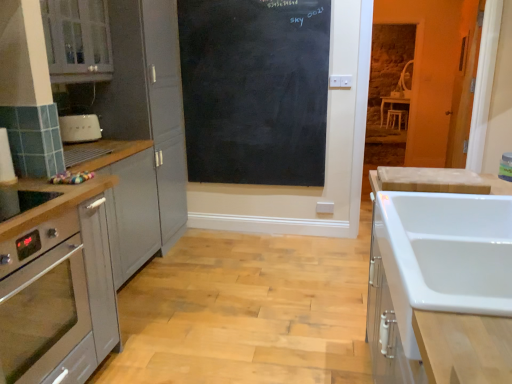
Question: From the image's perspective, is matte gray cabinet at upper left, which is the 1th cabinetry in left-to-right order, under white glossy sink at right, which appears as the first cabinetry when viewed from the right?

Choices:
 (A) no
 (B) yes

Answer: (A)

Question: Is matte gray cabinet at upper left, the third cabinetry when ordered from right to left, in contact with white glossy sink at right, arranged as the 3th cabinetry when viewed from the left?

Choices:
 (A) yes
 (B) no

Answer: (B)

Question: Is matte gray cabinet at upper left, the third cabinetry when ordered from right to left, far away from white glossy sink at right, which appears as the first cabinetry when viewed from the right?

Choices:
 (A) yes
 (B) no

Answer: (A)

Question: Can you confirm if matte gray cabinet at upper left, which is the 1th cabinetry in left-to-right order, is wider than white glossy sink at right, arranged as the 3th cabinetry when viewed from the left?

Choices:
 (A) no
 (B) yes

Answer: (A)

Question: Considering the relative sizes of matte gray cabinet at upper left, which is the 1th cabinetry in left-to-right order, and white glossy sink at right, arranged as the 3th cabinetry when viewed from the left, in the image provided, is matte gray cabinet at upper left, which is the 1th cabinetry in left-to-right order, smaller than white glossy sink at right, arranged as the 3th cabinetry when viewed from the left,?

Choices:
 (A) no
 (B) yes

Answer: (B)

Question: Considering the relative sizes of matte gray cabinet at upper left, the third cabinetry when ordered from right to left, and white glossy sink at right, arranged as the 3th cabinetry when viewed from the left, in the image provided, is matte gray cabinet at upper left, the third cabinetry when ordered from right to left, taller than white glossy sink at right, arranged as the 3th cabinetry when viewed from the left,?

Choices:
 (A) yes
 (B) no

Answer: (B)

Question: From a real-world perspective, is clear plastic bottle at upper right, the first appliance from the bottom, located beneath satin silver cabinet at left, the second cabinetry viewed from the left?

Choices:
 (A) no
 (B) yes

Answer: (A)

Question: Could you tell me if clear plastic bottle at upper right, which is the 1th appliance from front to back, is turned towards satin silver cabinet at left, the second cabinetry viewed from the left?

Choices:
 (A) no
 (B) yes

Answer: (A)

Question: Considering the relative positions of clear plastic bottle at upper right, the second appliance from the left, and satin silver cabinet at left, the second cabinetry viewed from the left, in the image provided, is clear plastic bottle at upper right, the second appliance from the left, to the left of satin silver cabinet at left, the second cabinetry viewed from the left, from the viewer's perspective?

Choices:
 (A) yes
 (B) no

Answer: (B)

Question: Is clear plastic bottle at upper right, which is the 1th appliance from front to back, taller than satin silver cabinet at left, the second cabinetry viewed from the left?

Choices:
 (A) yes
 (B) no

Answer: (B)

Question: Can you confirm if clear plastic bottle at upper right, the first appliance positioned from the right, is bigger than satin silver cabinet at left, the second cabinetry viewed from the left?

Choices:
 (A) no
 (B) yes

Answer: (A)

Question: From the image's perspective, is clear plastic bottle at upper right, positioned as the 2th appliance in back-to-front order, on top of satin silver cabinet at left, the second cabinetry viewed from the left?

Choices:
 (A) yes
 (B) no

Answer: (A)

Question: Is white matte toaster at left, placed as the 1th appliance when sorted from top to bottom, next to matte gray cabinet at upper left, which is the 1th cabinetry in left-to-right order?

Choices:
 (A) yes
 (B) no

Answer: (B)